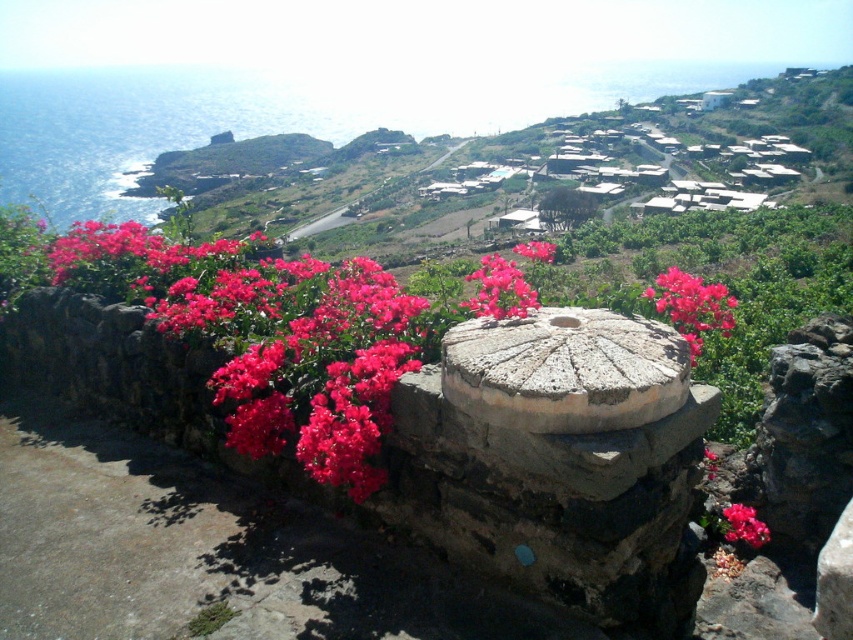
Question: Which point is closer to the camera?

Choices:
 (A) (677, 291)
 (B) (737, 509)

Answer: (A)

Question: Is matte pink flowers at center wider than matte pink flower at center?

Choices:
 (A) no
 (B) yes

Answer: (B)

Question: Which object appears closest to the camera in this image?

Choices:
 (A) matte pink flower at center
 (B) matte pink petals at center
 (C) gray weathered millstone at center

Answer: (C)

Question: Which point is closer to the camera?

Choices:
 (A) 757,547
 (B) 543,262
 (C) 531,288
 (D) 480,404

Answer: (D)

Question: Is matte pink petals at center in front of matte pink flower at center?

Choices:
 (A) no
 (B) yes

Answer: (B)

Question: Can you confirm if gray weathered millstone at center is smaller than pink matte flower at center?

Choices:
 (A) yes
 (B) no

Answer: (A)